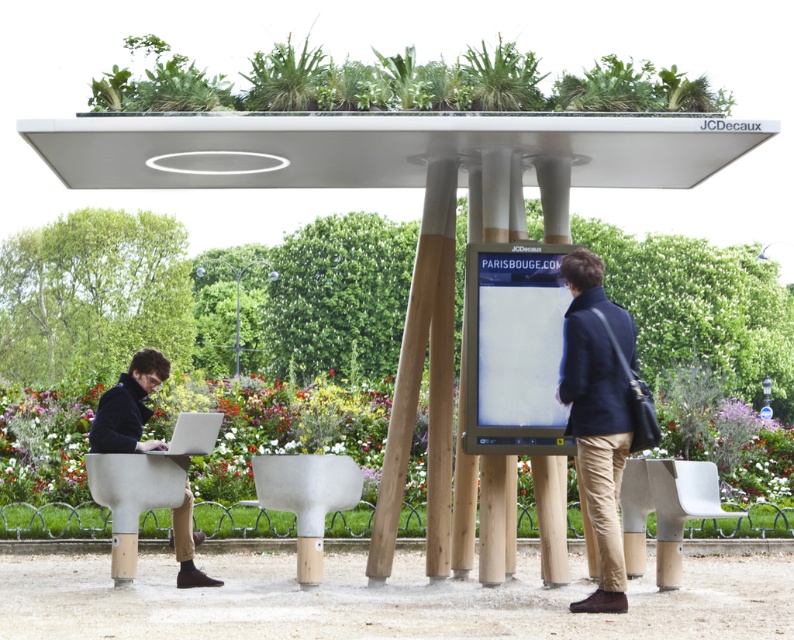
You are a delivery person who needs to place a package on the ground between the matte black jacket at lower left and the white plastic chair at lower right. Can you fit the package there if the package is 1 meter long?

The matte black jacket at lower left is located above the white plastic chair at lower right, so there is no horizontal space between them for the package. The package cannot be placed there.

You are standing at the entrance of the bus stop and want to find the green leafy plant at center. Based on your current position, is the plant to your left or right side?

The green leafy plant at center is located at point 0.666 on the x axis and 0.346 on the y axis. Since the entrance is typically at the front of the structure, which would be facing towards the lower y coordinate, the plant is positioned to the right side from your perspective.

You are a delivery person who needs to place a large package that is 4 meters long between the green leafy plant at center and the white wood table at center. Can you fit the package between them without bending it?

The distance between the green leafy plant at center and the white wood table at center is 4.20 meters, so yes, the package can be placed between them as the space is slightly longer than the package.